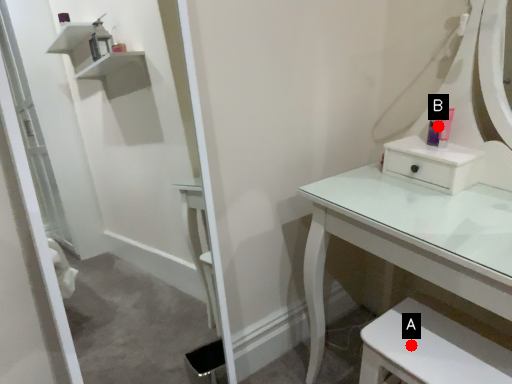
Question: Two points are circled on the image, labeled by A and B beside each circle. Which point is farther from the camera taking this photo?

Choices:
 (A) A is further
 (B) B is further

Answer: (B)